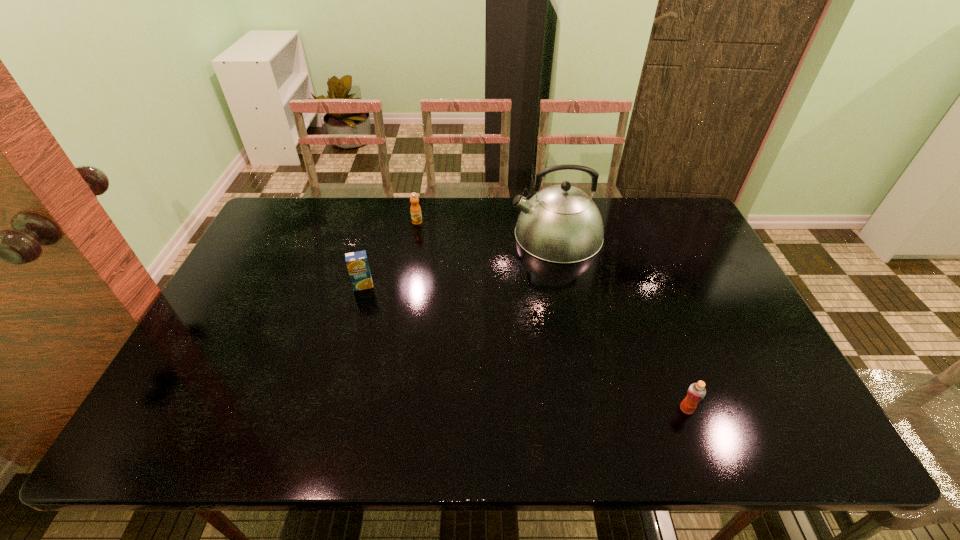
I want to click on vacant space that satisfies the following two spatial constraints: 1. on the front label of the rightmost object; 2. on the left side of the third object from right to left, so click(386, 409).

Where is `vacant space that satisfies the following two spatial constraints: 1. on the front label of the second object from left to right; 2. on the right side of the nearest orange juice`? Image resolution: width=960 pixels, height=540 pixels. vacant space that satisfies the following two spatial constraints: 1. on the front label of the second object from left to right; 2. on the right side of the nearest orange juice is located at coordinates (386, 409).